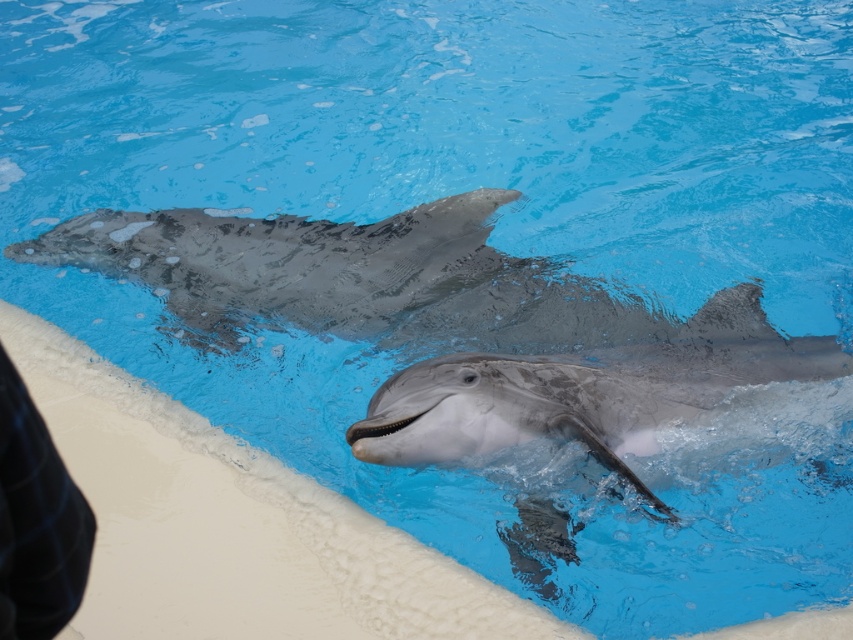
You are standing at the edge of the pool and want to take a photo of the smooth gray dolphin at center. If your camera is set to focus at the point with coordinates 0.6, 0.7, will it capture the dolphin clearly?

The smooth gray dolphin at center is located at point (x=596, y=394), which is very close to the focus point (x=596, y=384). The slight difference in coordinates means the camera should still capture the dolphin clearly.

You are a photographer trying to capture the smooth gray dolphin at center and the black checkered fabric at lower left in the same frame. Based on their sizes, which object should you focus on first to ensure both fit in the photo?

The smooth gray dolphin at center is larger in size than the black checkered fabric at lower left, so you should focus on the smooth gray dolphin at center first to ensure both fit in the photo.